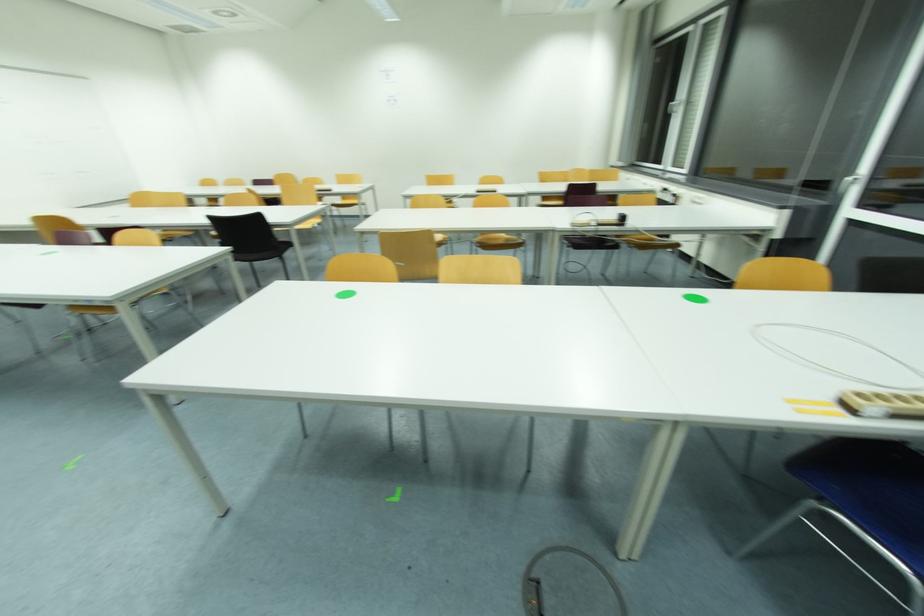
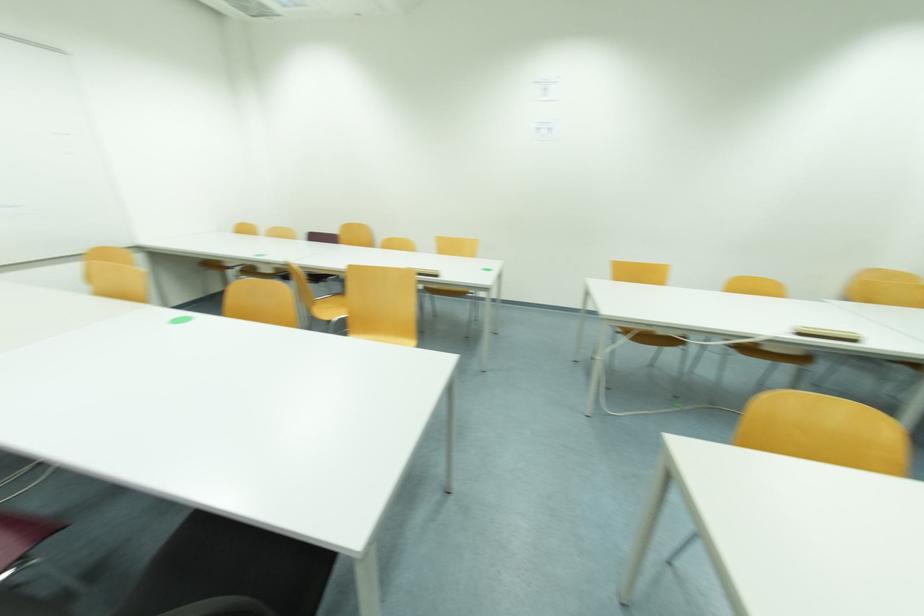
What movement of the cameraman would produce the second image?

The cameraman moved toward left, forward.